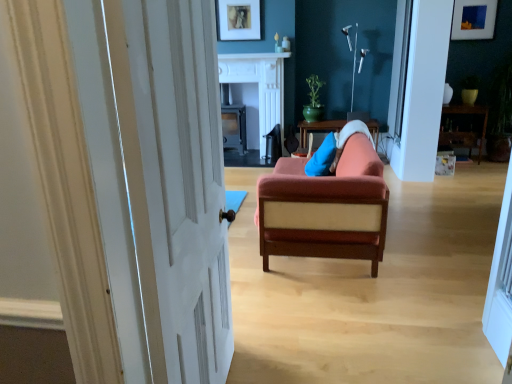
Question: Is white marble fireplace at center at the right side of velvet orange sofa at center?

Choices:
 (A) yes
 (B) no

Answer: (B)

Question: Is white marble fireplace at center shorter than velvet orange sofa at center?

Choices:
 (A) no
 (B) yes

Answer: (A)

Question: Is velvet orange sofa at center completely or partially inside white marble fireplace at center?

Choices:
 (A) no
 (B) yes

Answer: (A)

Question: From a real-world perspective, is white marble fireplace at center on top of velvet orange sofa at center?

Choices:
 (A) yes
 (B) no

Answer: (A)

Question: From the image's perspective, would you say white marble fireplace at center is shown under velvet orange sofa at center?

Choices:
 (A) no
 (B) yes

Answer: (A)

Question: Is white marble fireplace at upper center inside the boundaries of velvet orange sofa at center, or outside?

Choices:
 (A) inside
 (B) outside

Answer: (B)

Question: Is white marble fireplace at upper center wider or thinner than velvet orange sofa at center?

Choices:
 (A) thin
 (B) wide

Answer: (A)

Question: Would you say white marble fireplace at upper center is to the left or to the right of velvet orange sofa at center in the picture?

Choices:
 (A) right
 (B) left

Answer: (B)

Question: Considering the positions of point (219, 54) and point (373, 249), is point (219, 54) closer or farther from the camera than point (373, 249)?

Choices:
 (A) closer
 (B) farther

Answer: (B)

Question: Is wooden table at right, the 1th table in the right-to-left sequence, spatially inside matte blue picture frame at upper right, which is the 1th picture frame from right to left, or outside of it?

Choices:
 (A) inside
 (B) outside

Answer: (B)

Question: From a real-world perspective, relative to matte blue picture frame at upper right, the 2th picture frame when ordered from left to right, is wooden table at right, which is the 2th table from left to right, vertically above or below?

Choices:
 (A) above
 (B) below

Answer: (B)

Question: From the image's perspective, relative to matte blue picture frame at upper right, the 2th picture frame when ordered from left to right, is wooden table at right, which is the 2th table from left to right, above or below?

Choices:
 (A) above
 (B) below

Answer: (B)

Question: Is wooden table at right, the 1th table in the right-to-left sequence, wider or thinner than matte blue picture frame at upper right, the 2th picture frame when ordered from left to right?

Choices:
 (A) thin
 (B) wide

Answer: (B)

Question: Is green glossy pot at upper center wider or thinner than wooden table at right, which is the 2th table from left to right?

Choices:
 (A) wide
 (B) thin

Answer: (B)

Question: Which is correct: green glossy pot at upper center is inside wooden table at right, the 1th table in the right-to-left sequence, or outside of it?

Choices:
 (A) inside
 (B) outside

Answer: (B)